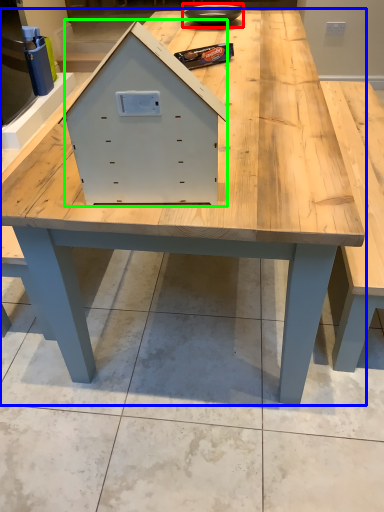
Question: Which is nearer to the bowl (highlighted by a red box)? table (highlighted by a blue box) or drawer (highlighted by a green box).

Choices:
 (A) table
 (B) drawer

Answer: (A)